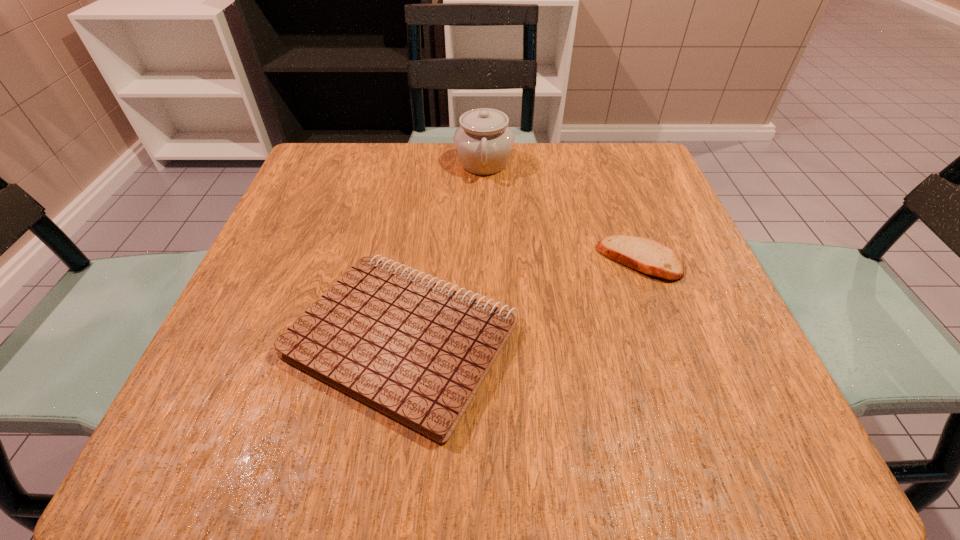
In order to click on vacant area that lies between the notebook and the pita bread in this screenshot , I will do `click(520, 300)`.

Find the location of a particular element. The image size is (960, 540). free space between the chinaware and the rightmost object is located at coordinates (562, 212).

At what (x,y) coordinates should I click in order to perform the action: click on empty location between the notebook and the pita bread. Please return your answer as a coordinate pair (x, y). Looking at the image, I should click on point(520,300).

Locate an element on the screen. free spot between the notebook and the tallest object is located at coordinates (443, 251).

Find the location of `vacant space that is in between the chinaware and the notebook`. vacant space that is in between the chinaware and the notebook is located at coordinates (443, 251).

Locate an element on the screen. free space between the tallest object and the shortest object is located at coordinates (562, 212).

Identify the location of free space between the chinaware and the notebook. (443, 251).

Where is `vacant space that is in between the notebook and the farthest object`? vacant space that is in between the notebook and the farthest object is located at coordinates (443, 251).

This screenshot has width=960, height=540. Identify the location of vacant space that's between the pita bread and the notebook. (520, 300).

I want to click on the closest object to the rightmost object, so click(417, 351).